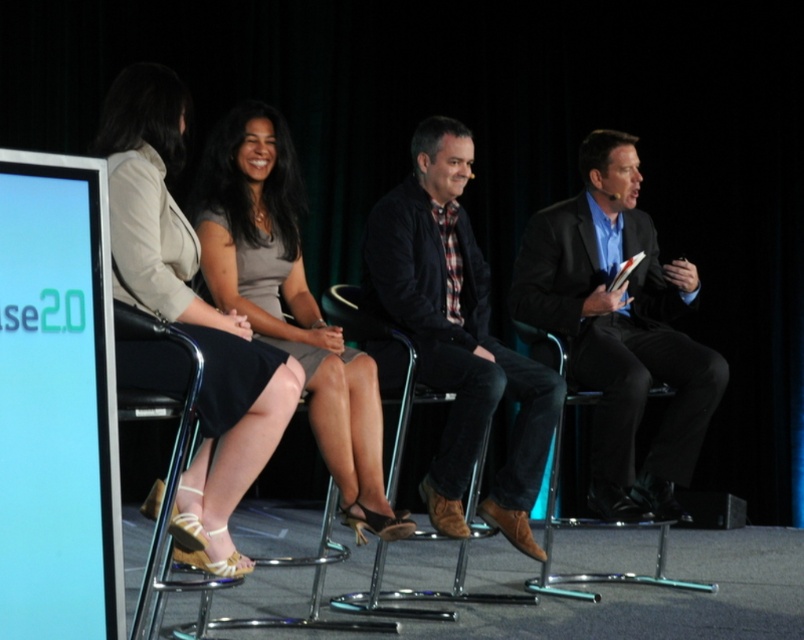
Question: Does matte beige dress at center appear on the right side of matte gray dress at center?

Choices:
 (A) yes
 (B) no

Answer: (B)

Question: Which object is closer to the camera taking this photo?

Choices:
 (A) dark brown leather jacket at center
 (B) metallic silver stool at center
 (C) matte black suit at right

Answer: (B)

Question: Which object is the closest to the metallic chrome chair at right?

Choices:
 (A) matte beige dress at center
 (B) metallic silver chair at lower left
 (C) matte gray dress at center

Answer: (C)

Question: Among these points, which one is farthest from the camera?

Choices:
 (A) (456, 579)
 (B) (376, 444)
 (C) (142, 589)
 (D) (575, 392)

Answer: (D)

Question: Is matte beige dress at center wider than metallic silver stool at center?

Choices:
 (A) yes
 (B) no

Answer: (B)

Question: Does matte beige dress at center have a greater width compared to metallic silver stool at center?

Choices:
 (A) yes
 (B) no

Answer: (B)